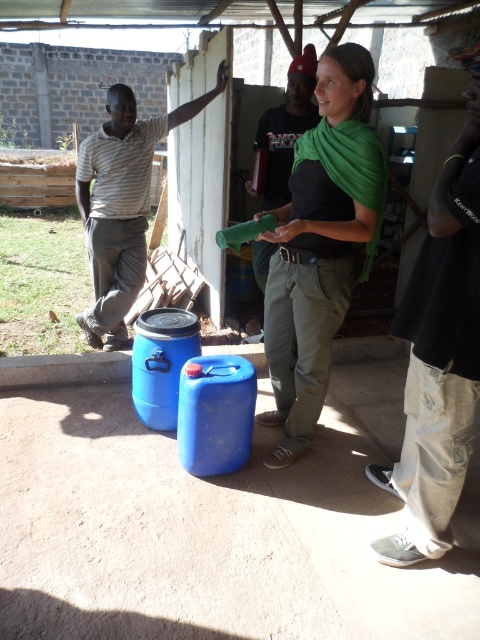
Does green matte scarf at center lie in front of striped cotton shirt at left?

Yes, it is.

Which of these two, green matte scarf at center or striped cotton shirt at left, stands shorter?

green matte scarf at center is shorter.

In order to click on green matte scarf at center in this screenshot , I will do `click(321, 243)`.

Who is more forward, (317,348) or (457,314)?

Point (457,314) is in front.

Find the location of a particular element. This screenshot has width=480, height=640. green matte scarf at center is located at coordinates (321, 243).

Can you confirm if black cotton shirt at center is positioned above striped cotton shirt at left?

Actually, black cotton shirt at center is below striped cotton shirt at left.

Which is more to the right, black cotton shirt at center or striped cotton shirt at left?

From the viewer's perspective, black cotton shirt at center appears more on the right side.

Where is `black cotton shirt at center`? The image size is (480, 640). black cotton shirt at center is located at coordinates (440, 353).

You are a GUI agent. You are given a task and a screenshot of the screen. Output one action in this format:
    pyautogui.click(x=<x>, y=<y>)
    Task: Click on the black cotton shirt at center
    Image resolution: width=480 pixels, height=640 pixels.
    Given the screenshot: What is the action you would take?
    pyautogui.click(x=440, y=353)